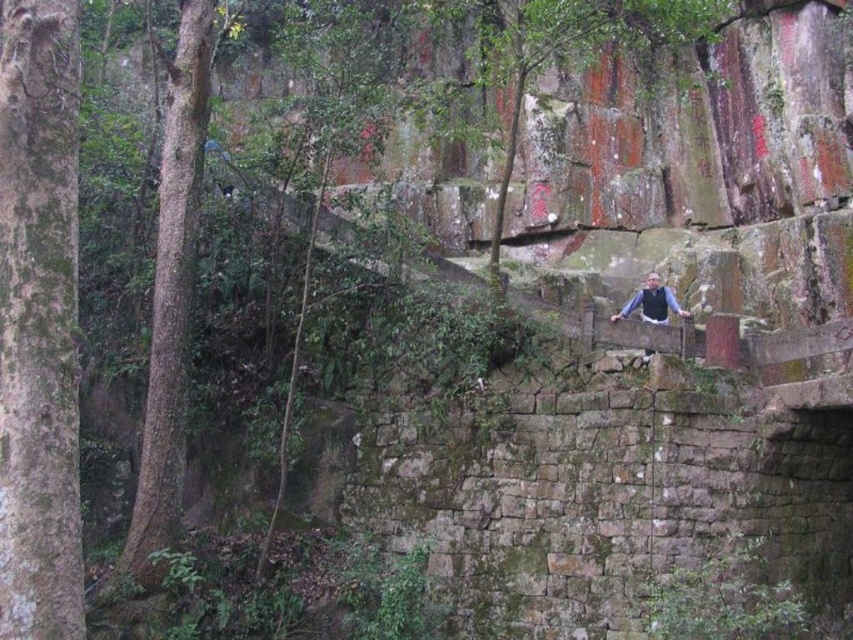
From the picture: Measure the distance between point (71, 636) and camera.

They are 33.00 meters apart.

Is green mossy bark tree at left smaller than green rough bark tree at left?

Indeed, green mossy bark tree at left has a smaller size compared to green rough bark tree at left.

Does point (54, 390) come behind point (160, 520)?

No, (54, 390) is closer to viewer.

Where is `green mossy bark tree at left`? green mossy bark tree at left is located at coordinates (39, 323).